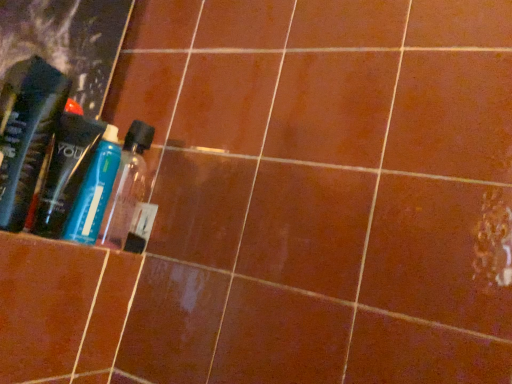
Question: From a real-world perspective, is translucent plastic bottle at left, marked as the second bottle in a back-to-front arrangement, physically below translucent plastic bottle at left?

Choices:
 (A) yes
 (B) no

Answer: (A)

Question: Can you confirm if translucent plastic bottle at left, marked as the second bottle in a back-to-front arrangement, is positioned to the left of translucent plastic bottle at left?

Choices:
 (A) no
 (B) yes

Answer: (A)

Question: Is translucent plastic bottle at left, marked as the second bottle in a back-to-front arrangement, far from translucent plastic bottle at left?

Choices:
 (A) yes
 (B) no

Answer: (B)

Question: Does translucent plastic bottle at left, marked as the second bottle in a back-to-front arrangement, come in front of translucent plastic bottle at left?

Choices:
 (A) no
 (B) yes

Answer: (B)

Question: From the image's perspective, would you say translucent plastic bottle at left, the first bottle from the front, is shown under translucent plastic bottle at left?

Choices:
 (A) yes
 (B) no

Answer: (A)

Question: From the image's perspective, relative to translucent plastic bottle at left, the first bottle from the front, is transparent plastic bottle at center, which ranks as the first bottle in back-to-front order, above or below?

Choices:
 (A) below
 (B) above

Answer: (A)

Question: From a real-world perspective, relative to translucent plastic bottle at left, marked as the second bottle in a back-to-front arrangement, is transparent plastic bottle at center, which ranks as the first bottle in back-to-front order, vertically above or below?

Choices:
 (A) above
 (B) below

Answer: (B)

Question: Is point (114, 145) closer or farther from the camera than point (9, 130)?

Choices:
 (A) farther
 (B) closer

Answer: (A)

Question: Based on their sizes in the image, would you say transparent plastic bottle at center, which ranks as the first bottle in back-to-front order, is bigger or smaller than translucent plastic bottle at left, the first bottle from the front?

Choices:
 (A) big
 (B) small

Answer: (B)

Question: Does point (7, 205) appear closer or farther from the camera than point (97, 152)?

Choices:
 (A) farther
 (B) closer

Answer: (B)

Question: Is translucent plastic bottle at left, marked as the second bottle in a back-to-front arrangement, bigger or smaller than transparent plastic bottle at center, the second bottle positioned from the front?

Choices:
 (A) big
 (B) small

Answer: (A)

Question: In terms of height, does translucent plastic bottle at left, the first bottle from the front, look taller or shorter compared to transparent plastic bottle at center, which ranks as the first bottle in back-to-front order?

Choices:
 (A) tall
 (B) short

Answer: (A)

Question: In the image, is translucent plastic bottle at left, marked as the second bottle in a back-to-front arrangement, positioned in front of or behind transparent plastic bottle at center, the second bottle positioned from the front?

Choices:
 (A) front
 (B) behind

Answer: (A)

Question: From their relative heights in the image, would you say transparent plastic bottle at center, which ranks as the first bottle in back-to-front order, is taller or shorter than translucent plastic bottle at left?

Choices:
 (A) tall
 (B) short

Answer: (B)

Question: From the image's perspective, is transparent plastic bottle at center, which ranks as the first bottle in back-to-front order, located above or below translucent plastic bottle at left?

Choices:
 (A) above
 (B) below

Answer: (B)